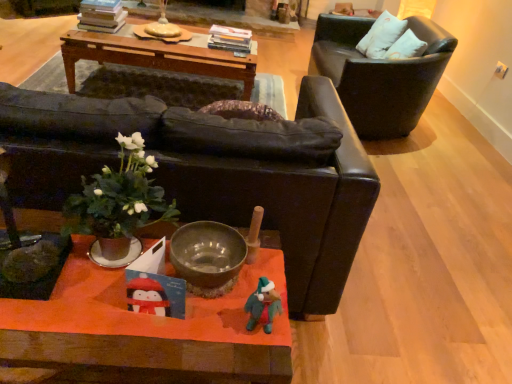
Image resolution: width=512 pixels, height=384 pixels. In order to click on free space between felt-like green toy at lower center and metallic silver bowl at center in this screenshot , I will do `click(225, 312)`.